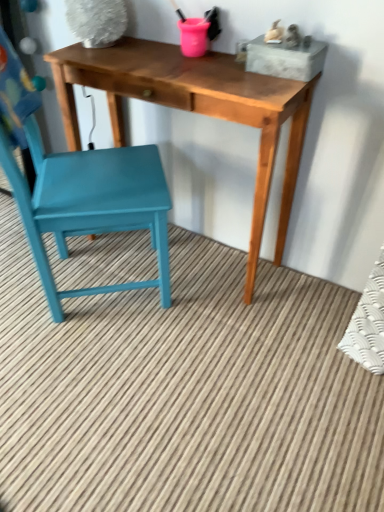
What are the coordinates of `vacant space in between wooden table at center and teal painted wood chair at left` in the screenshot? It's located at (173, 302).